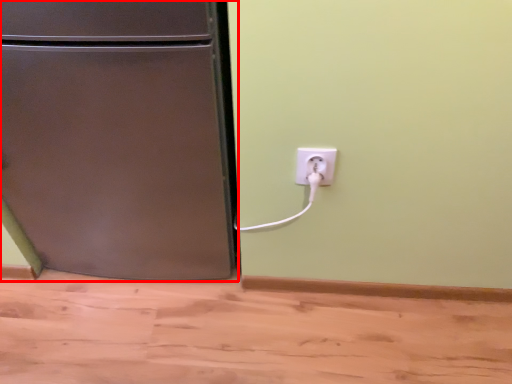
Question: From the image's perspective, what is the correct spatial positioning of refrigerator (annotated by the red box) in reference to power plugs and sockets?

Choices:
 (A) below
 (B) above

Answer: (B)